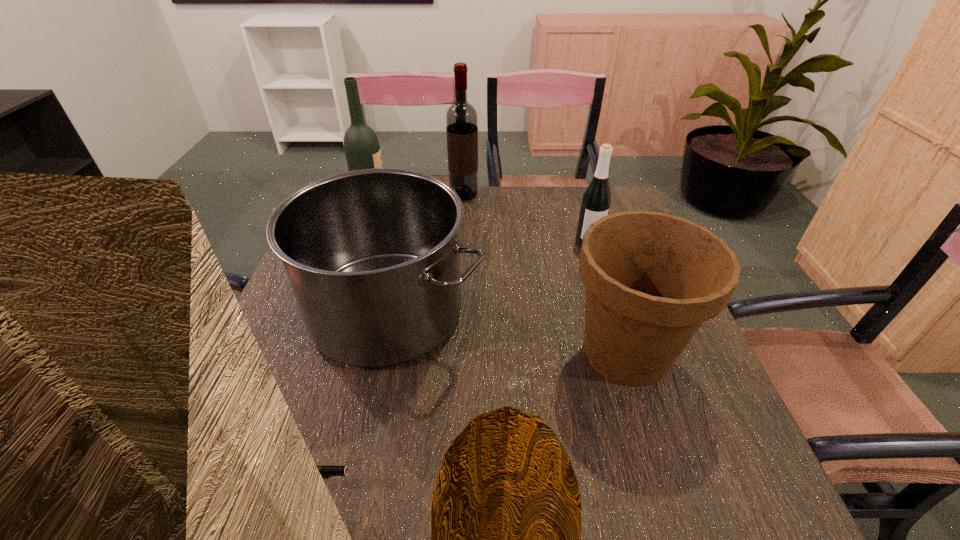
Identify the location of the third closest wine bottle relative to the shortest object. (461, 117).

Find the location of a particular element. vacant area in the image that satisfies the following two spatial constraints: 1. on the front side of the flowerpot; 2. at the muzzle of the nearest object is located at coordinates (670, 491).

I want to click on vacant space that satisfies the following two spatial constraints: 1. on the front side of the flowerpot; 2. on the left side of the saucepan, so click(377, 353).

You are a GUI agent. You are given a task and a screenshot of the screen. Output one action in this format:
    pyautogui.click(x=<x>, y=<y>)
    Task: Click on the blank area in the image that satisfies the following two spatial constraints: 1. on the labeled side of the saucepan; 2. on the right side of the leftmost wine bottle
    
    Given the screenshot: What is the action you would take?
    pyautogui.click(x=339, y=312)

This screenshot has height=540, width=960. What are the coordinates of `blank area in the image that satisfies the following two spatial constraints: 1. on the label of the flowerpot; 2. on the right side of the nearest wine bottle` in the screenshot? It's located at (622, 353).